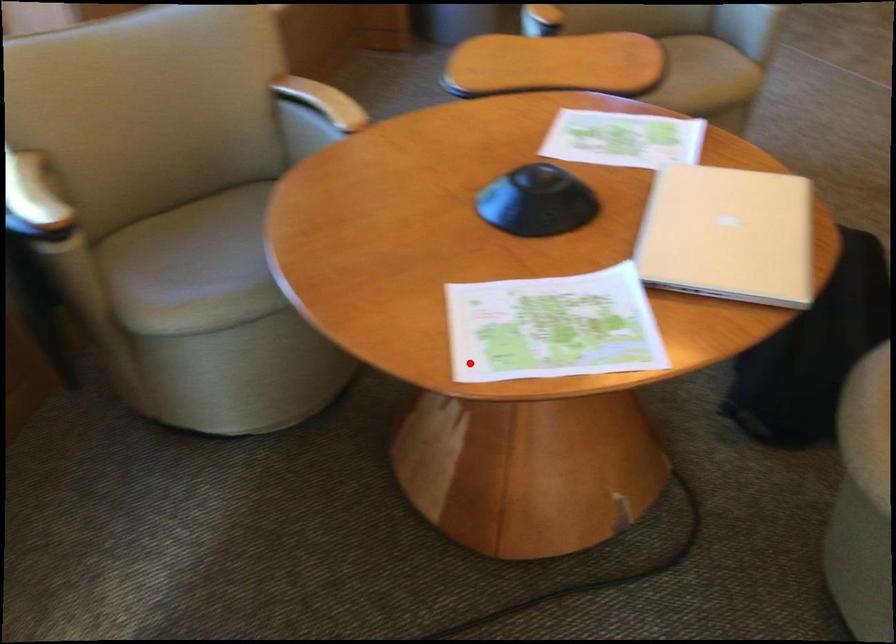
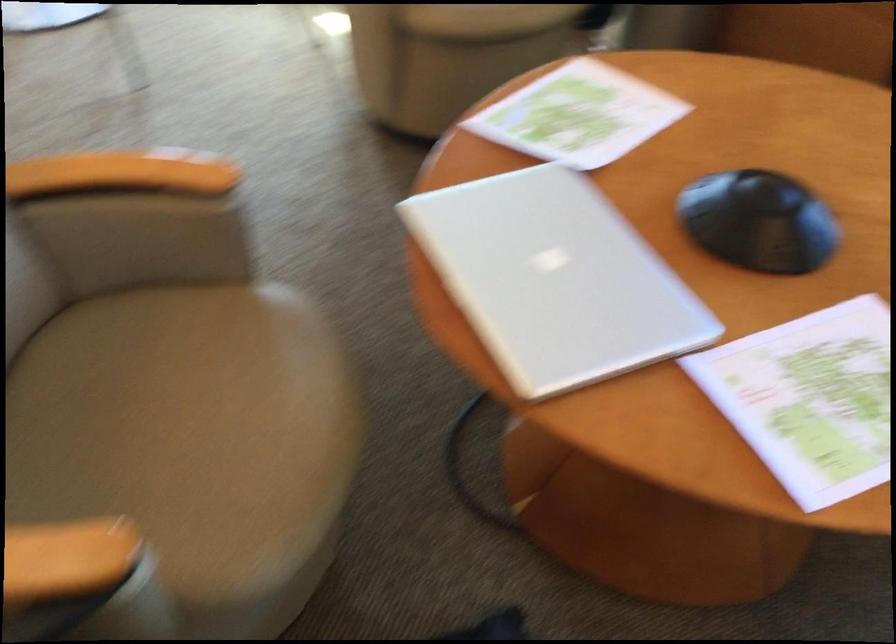
In the second image, find the point that corresponds to the highlighted location in the first image.

(579, 115)